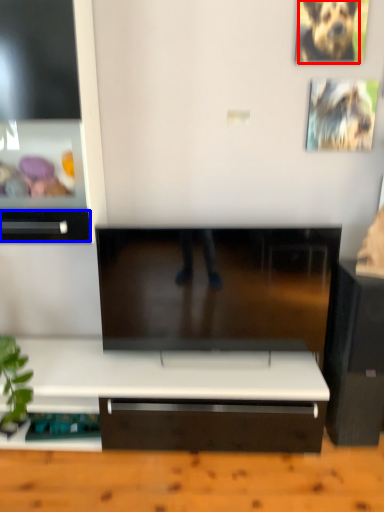
Question: Which object is closer to the camera taking this photo, animal (highlighted by a red box) or drawer (highlighted by a blue box)?

Choices:
 (A) animal
 (B) drawer

Answer: (B)